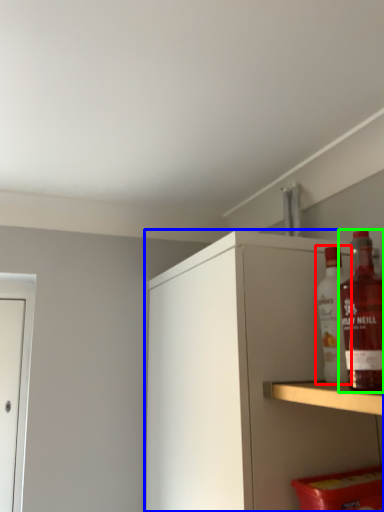
Question: Based on their relative distances, which object is farther from bottle (highlighted by a red box)? Choose from cabinetry (highlighted by a blue box) and bottle (highlighted by a green box).

Choices:
 (A) cabinetry
 (B) bottle

Answer: (A)